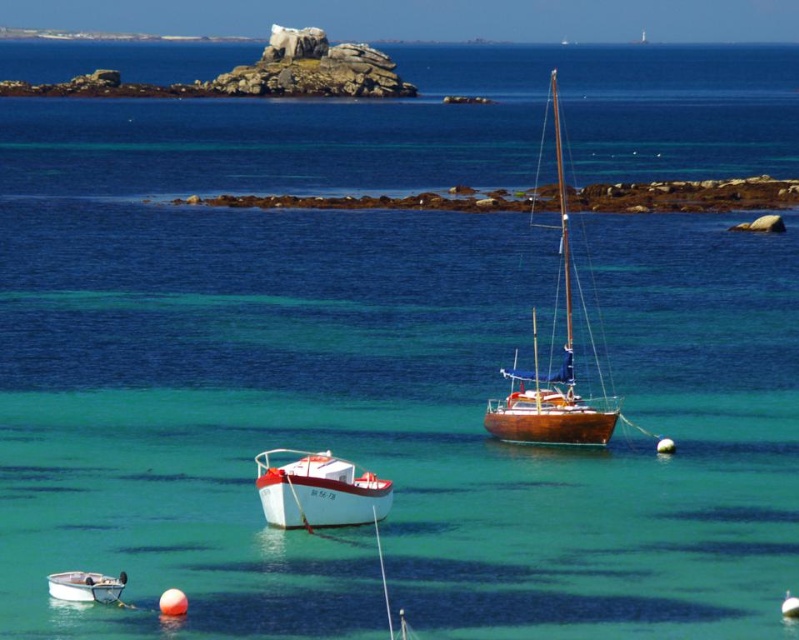
Is wooden sailboat at center above white plastic boat at lower left?

Correct, wooden sailboat at center is located above white plastic boat at lower left.

Is point (541, 154) positioned in front of point (89, 588)?

No, (541, 154) is further to viewer.

Between point (585, 416) and point (54, 593), which one is positioned in front?

Point (54, 593) is in front.

Locate an element on the screen. wooden sailboat at center is located at coordinates (551, 356).

Does white matte boat at center have a lesser width compared to white plastic boat at lower left?

In fact, white matte boat at center might be wider than white plastic boat at lower left.

This screenshot has height=640, width=799. I want to click on white matte boat at center, so click(x=317, y=492).

This screenshot has width=799, height=640. In order to click on white matte boat at center in this screenshot , I will do `click(317, 492)`.

From the picture: Who is more forward, (563, 324) or (386, 509)?

Point (386, 509) is more forward.

Measure the distance between wooden sailboat at center and camera.

A: The distance of wooden sailboat at center from camera is 160.16 feet.

Is point (605, 433) positioned behind point (348, 515)?

Yes, it is behind point (348, 515).

Find the location of a particular element. wooden sailboat at center is located at coordinates (551, 356).